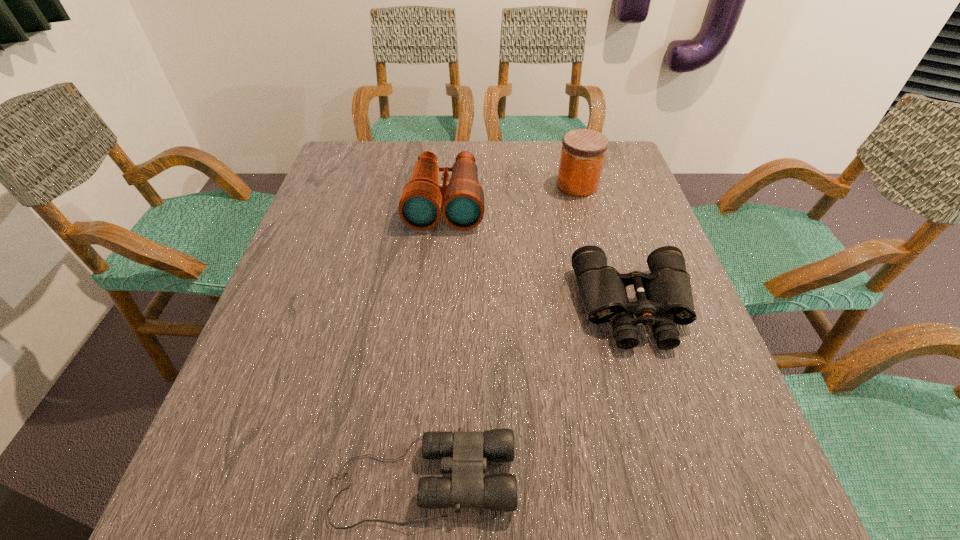
Image resolution: width=960 pixels, height=540 pixels. In order to click on free location that satisfies the following two spatial constraints: 1. through the eyepieces of the second tallest binoculars; 2. at the eyepiece of the shortest binoculars in this screenshot , I will do `click(688, 480)`.

Locate an element on the screen. The height and width of the screenshot is (540, 960). vacant point that satisfies the following two spatial constraints: 1. on the front side of the tallest object; 2. at the eyepiece of the nearest binoculars is located at coordinates (657, 480).